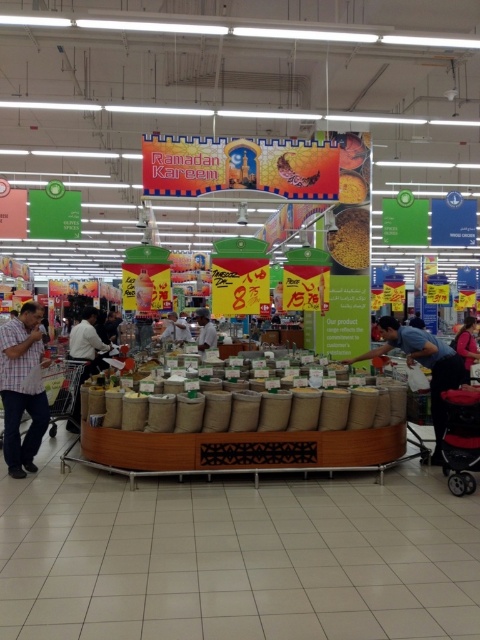
Question: Which point appears closest to the camera in this image?

Choices:
 (A) (72, 412)
 (B) (445, 346)
 (C) (369, 397)
 (D) (335, 218)

Answer: (C)

Question: Does velvet pink dress at lower right appear on the right side of matte black shirt at center?

Choices:
 (A) no
 (B) yes

Answer: (B)

Question: Which point is farther from the camera taking this photo?

Choices:
 (A) (213, 326)
 (B) (67, 387)
 (C) (156, 403)

Answer: (A)

Question: Is velvet pink dress at lower right to the left of matte black shirt at center from the viewer's perspective?

Choices:
 (A) no
 (B) yes

Answer: (A)

Question: Estimate the real-world distances between objects in this image. Which object is closer to the metallic silver shopping cart at lower left?

Choices:
 (A) burlap sack spice at center
 (B) plaid shirt at left
 (C) yellow matte spice at center

Answer: (B)

Question: Does burlap sack spice at center have a smaller size compared to velvet pink dress at lower right?

Choices:
 (A) yes
 (B) no

Answer: (A)